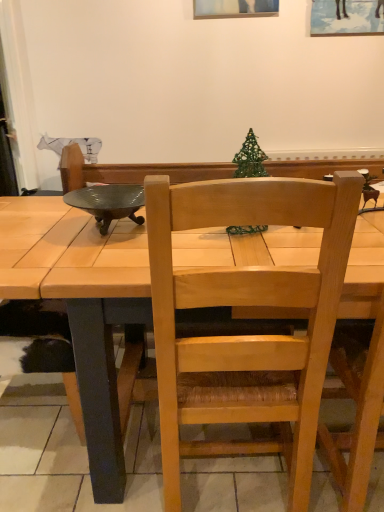
Measure the distance between point (202,281) and camera.

Point (202,281) is 34.80 inches away from camera.

This screenshot has height=512, width=384. What do you see at coordinates (246, 335) in the screenshot?
I see `light wood chair at center` at bounding box center [246, 335].

You are a GUI agent. You are given a task and a screenshot of the screen. Output one action in this format:
    pyautogui.click(x=<x>, y=<y>)
    Task: Click on the light wood chair at center
    
    Given the screenshot: What is the action you would take?
    (x=246, y=335)

What is the approximate width of light wood chair at center?

light wood chair at center is 18.46 inches wide.

The width and height of the screenshot is (384, 512). What do you see at coordinates (108, 203) in the screenshot? I see `metallic green bowl at upper left` at bounding box center [108, 203].

Find the location of a particular element. Image resolution: width=384 pixels, height=512 pixels. metallic green bowl at upper left is located at coordinates (108, 203).

Where is `light wood chair at center`? light wood chair at center is located at coordinates (246, 335).

Between light wood chair at center and metallic green bowl at upper left, which one appears on the left side from the viewer's perspective?

metallic green bowl at upper left.

Between light wood chair at center and metallic green bowl at upper left, which one is positioned in front?

light wood chair at center.

Which point is more distant from viewer, [240,195] or [67,200]?

The point [67,200] is farther from the camera.

From the image's perspective, is light wood chair at center above or below metallic green bowl at upper left?

Based on their image positions, light wood chair at center is located beneath metallic green bowl at upper left.

From a real-world perspective, who is located lower, light wood chair at center or metallic green bowl at upper left?

light wood chair at center.

Is light wood chair at center thinner than metallic green bowl at upper left?

Incorrect, the width of light wood chair at center is not less than that of metallic green bowl at upper left.

Between light wood chair at center and metallic green bowl at upper left, which one has less height?

metallic green bowl at upper left.

Which of these two, light wood chair at center or metallic green bowl at upper left, is smaller?

With smaller size is metallic green bowl at upper left.

Is light wood chair at center not inside metallic green bowl at upper left?

Absolutely, light wood chair at center is external to metallic green bowl at upper left.

Would you consider light wood chair at center to be distant from metallic green bowl at upper left?

No, there isn't a large distance between light wood chair at center and metallic green bowl at upper left.

Could you tell me if light wood chair at center is facing metallic green bowl at upper left?

No, light wood chair at center is not turned towards metallic green bowl at upper left.

I want to click on bowl lying behind the light wood chair at center, so click(108, 203).

Considering the positions of objects metallic green bowl at upper left and light wood chair at center in the image provided, who is more to the right, metallic green bowl at upper left or light wood chair at center?

light wood chair at center is more to the right.

Considering the positions of objects metallic green bowl at upper left and light wood chair at center in the image provided, who is in front, metallic green bowl at upper left or light wood chair at center?

light wood chair at center is closer to the camera.

Is point (137, 221) farther from viewer compared to point (249, 300)?

Yes, it is.

From the image's perspective, is metallic green bowl at upper left located above or below light wood chair at center?

Based on their image positions, metallic green bowl at upper left is located above light wood chair at center.

From a real-world perspective, relative to light wood chair at center, is metallic green bowl at upper left vertically above or below?

metallic green bowl at upper left is situated higher than light wood chair at center in the real world.

Which of these two, metallic green bowl at upper left or light wood chair at center, is thinner?

Thinner between the two is metallic green bowl at upper left.

Which of these two, metallic green bowl at upper left or light wood chair at center, stands shorter?

metallic green bowl at upper left.

Is metallic green bowl at upper left smaller than light wood chair at center?

Correct, metallic green bowl at upper left occupies less space than light wood chair at center.

Is metallic green bowl at upper left located outside light wood chair at center?

metallic green bowl at upper left is positioned outside light wood chair at center.

Are metallic green bowl at upper left and light wood chair at center far apart?

No, there isn't a large distance between metallic green bowl at upper left and light wood chair at center.

Is metallic green bowl at upper left oriented away from light wood chair at center?

No, metallic green bowl at upper left's orientation is not away from light wood chair at center.

Can you tell me how much metallic green bowl at upper left and light wood chair at center differ in facing direction?

They differ by 175 degrees in their facing directions.

This screenshot has height=512, width=384. What are the coordinates of `chair in front of the metallic green bowl at upper left` in the screenshot? It's located at (246, 335).

Where is `chair below the metallic green bowl at upper left (from a real-world perspective)`? The height and width of the screenshot is (512, 384). chair below the metallic green bowl at upper left (from a real-world perspective) is located at coordinates (246, 335).

Identify the location of chair in front of the metallic green bowl at upper left. (246, 335).